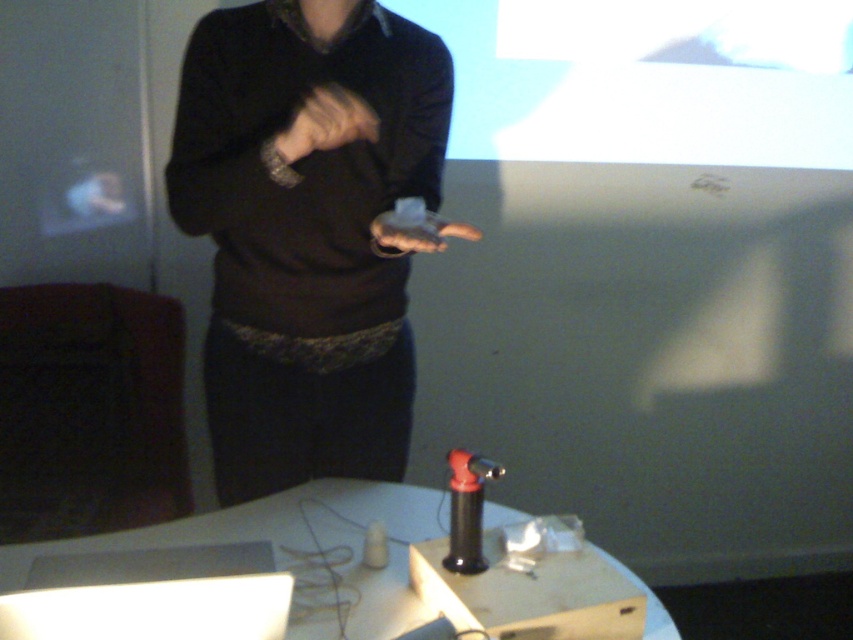
Who is lower down, matte black shirt at center or white cardboard box at center?

Positioned lower is white cardboard box at center.

Does matte black shirt at center appear under white cardboard box at center?

No, matte black shirt at center is not below white cardboard box at center.

The height and width of the screenshot is (640, 853). I want to click on matte black shirt at center, so click(x=306, y=230).

Can you confirm if matte black shirt at center is smaller than black matte tool at lower center?

No, matte black shirt at center is not smaller than black matte tool at lower center.

Who is shorter, matte black shirt at center or black matte tool at lower center?

With less height is black matte tool at lower center.

Who is more distant from viewer, (325, 106) or (460, 540)?

The point (460, 540) is behind.

At what (x,y) coordinates should I click in order to perform the action: click on matte black shirt at center. Please return your answer as a coordinate pair (x, y). Looking at the image, I should click on (306, 230).

Between matte black shirt at center and matte black hand at center, which one has more height?

matte black shirt at center

Describe the element at coordinates (306, 230) in the screenshot. The image size is (853, 640). I see `matte black shirt at center` at that location.

Find the location of a particular element. This screenshot has width=853, height=640. matte black shirt at center is located at coordinates (306, 230).

Identify the location of matte black shirt at center. The height and width of the screenshot is (640, 853). (306, 230).